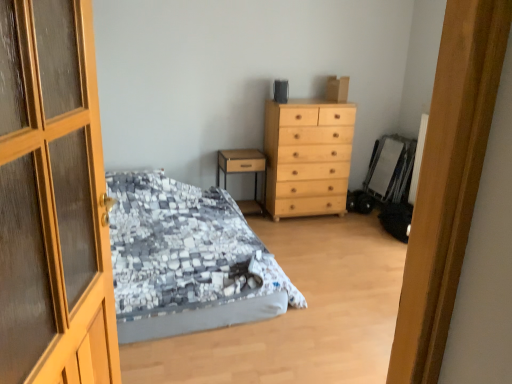
Question: From the image's perspective, would you say wooden nightstand at center is positioned over light wood/texture chest of drawers at center?

Choices:
 (A) yes
 (B) no

Answer: (B)

Question: Is wooden nightstand at center completely or partially outside of light wood/texture chest of drawers at center?

Choices:
 (A) no
 (B) yes

Answer: (B)

Question: Can you confirm if wooden nightstand at center is shorter than light wood/texture chest of drawers at center?

Choices:
 (A) no
 (B) yes

Answer: (B)

Question: From the image's perspective, would you say wooden nightstand at center is shown under light wood/texture chest of drawers at center?

Choices:
 (A) no
 (B) yes

Answer: (B)

Question: Can you confirm if wooden nightstand at center is bigger than light wood/texture chest of drawers at center?

Choices:
 (A) no
 (B) yes

Answer: (A)

Question: Considering the relative positions of wooden nightstand at center and light wood/texture chest of drawers at center in the image provided, is wooden nightstand at center to the left of light wood/texture chest of drawers at center from the viewer's perspective?

Choices:
 (A) no
 (B) yes

Answer: (B)

Question: Is wooden door at left wider than wooden nightstand at center?

Choices:
 (A) yes
 (B) no

Answer: (B)

Question: Is wooden door at left directly adjacent to wooden nightstand at center?

Choices:
 (A) no
 (B) yes

Answer: (A)

Question: Considering the relative sizes of wooden door at left and wooden nightstand at center in the image provided, is wooden door at left bigger than wooden nightstand at center?

Choices:
 (A) yes
 (B) no

Answer: (A)

Question: Can you confirm if wooden door at left is positioned to the left of wooden nightstand at center?

Choices:
 (A) no
 (B) yes

Answer: (B)

Question: Is wooden door at left completely or partially outside of wooden nightstand at center?

Choices:
 (A) yes
 (B) no

Answer: (A)

Question: Is wooden door at left closer to the viewer compared to wooden nightstand at center?

Choices:
 (A) no
 (B) yes

Answer: (B)

Question: From a real-world perspective, is wooden door at left below textured gray bed at center?

Choices:
 (A) yes
 (B) no

Answer: (B)